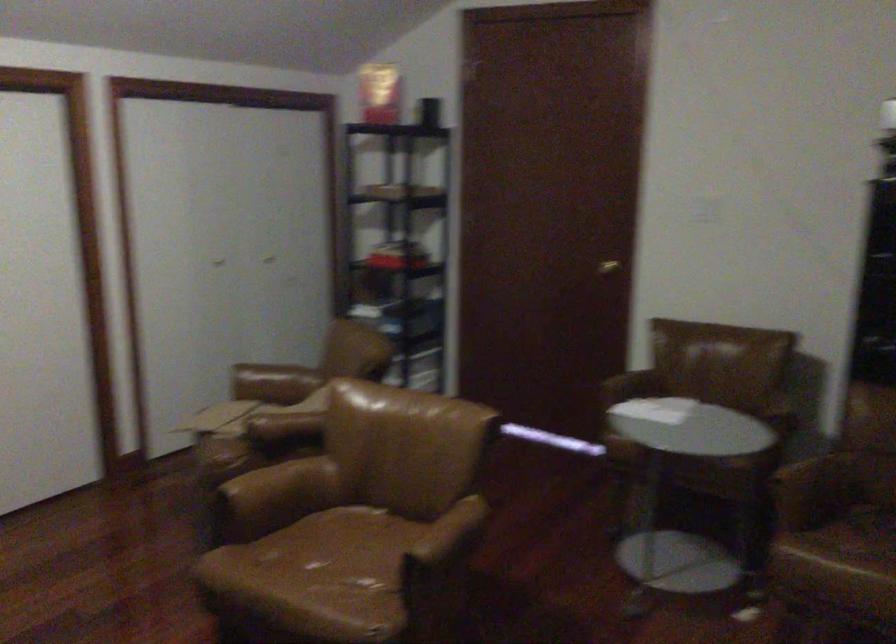
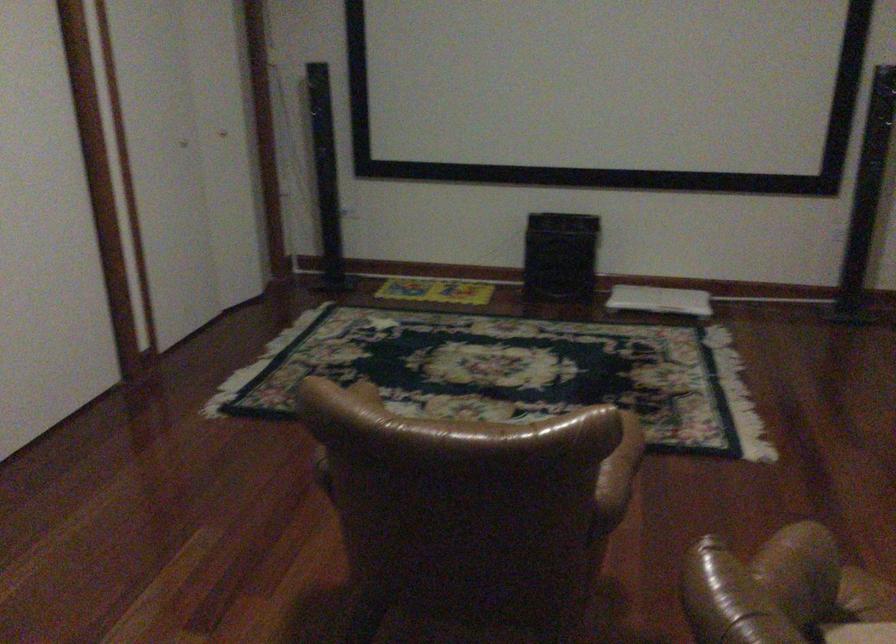
Where in the second image is the point corresponding to (263,486) from the first image?

(622, 460)